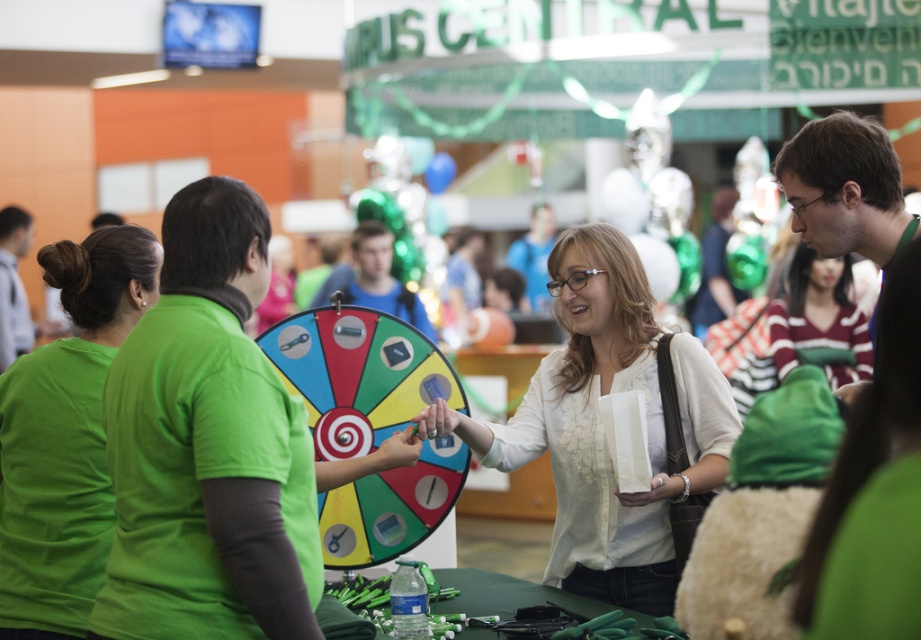
Does point (65, 401) come behind point (6, 266)?

That is False.

Describe the element at coordinates (66, 436) in the screenshot. The width and height of the screenshot is (921, 640). I see `green matte shirt at upper left` at that location.

In order to click on green matte shirt at upper left in this screenshot , I will do `click(66, 436)`.

Is green matte shirt at center wider than green t-shirt at left?

Incorrect, green matte shirt at center's width does not surpass green t-shirt at left's.

Which is below, green matte shirt at center or green t-shirt at left?

Positioned lower is green matte shirt at center.

Describe the element at coordinates (207, 445) in the screenshot. I see `green matte shirt at center` at that location.

Identify the location of green matte shirt at center. The image size is (921, 640). (207, 445).

Between green matte shirt at upper left and striped knit sweater at center, which one is positioned higher?

striped knit sweater at center

Between point (22, 396) and point (831, 288), which one is positioned behind?

Positioned behind is point (831, 288).

Image resolution: width=921 pixels, height=640 pixels. What do you see at coordinates (66, 436) in the screenshot?
I see `green matte shirt at upper left` at bounding box center [66, 436].

The height and width of the screenshot is (640, 921). I want to click on green matte shirt at upper left, so click(x=66, y=436).